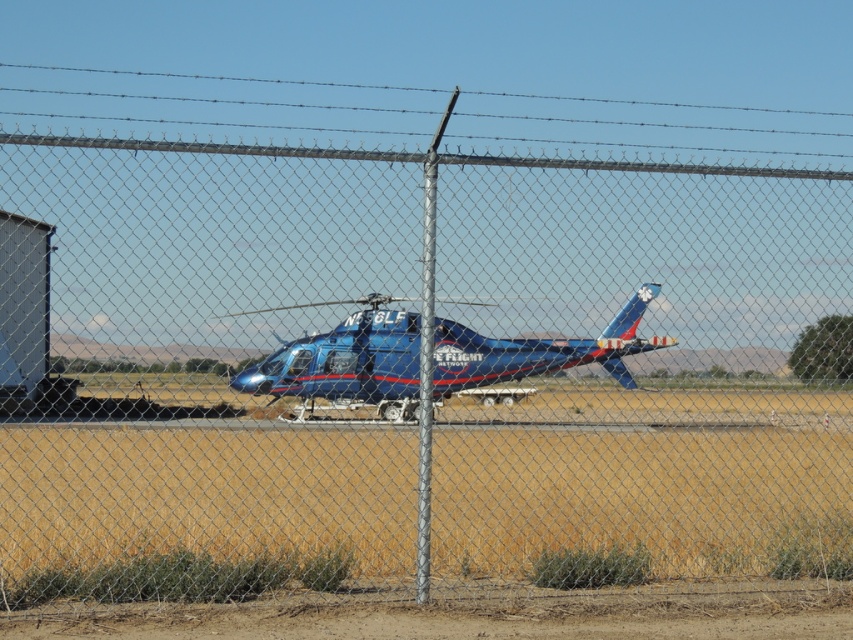
Question: Does blue glossy helicopter at center have a larger size compared to metallic blue trailer truck at left?

Choices:
 (A) no
 (B) yes

Answer: (A)

Question: Can you confirm if blue glossy helicopter at center is smaller than metallic blue trailer truck at left?

Choices:
 (A) yes
 (B) no

Answer: (A)

Question: Is blue glossy helicopter at center to the left of metallic blue trailer truck at left from the viewer's perspective?

Choices:
 (A) yes
 (B) no

Answer: (B)

Question: Which point is farther to the camera?

Choices:
 (A) metallic blue trailer truck at left
 (B) blue glossy helicopter at center

Answer: (B)